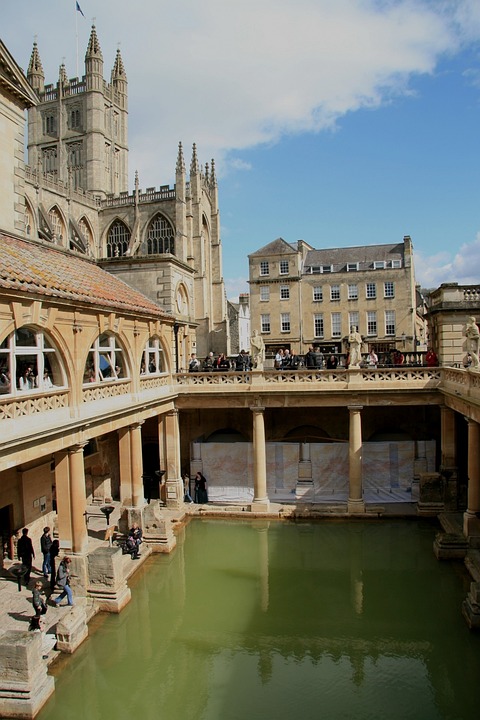
The image size is (480, 720). Identify the location of statue. (354, 343).